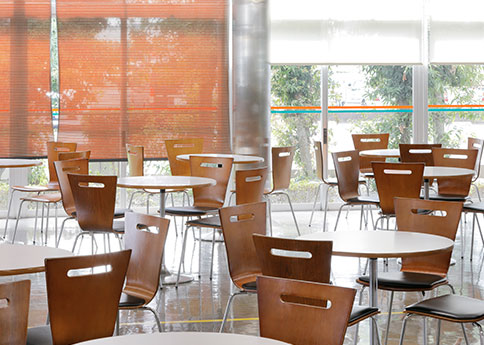
This screenshot has height=345, width=484. Find the location of `tables`. tables is located at coordinates (157, 188), (10, 158), (240, 156), (370, 146), (446, 174), (384, 241), (31, 254), (167, 339).